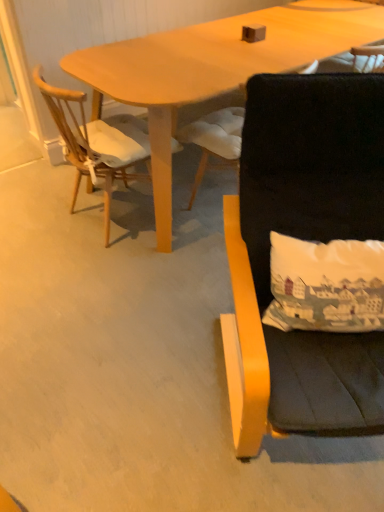
Question: From the image's perspective, would you say black fabric chair at right, which ranks as the first chair in right-to-left order, is positioned over black fabric chair at center, which is the second chair in right-to-left order?

Choices:
 (A) no
 (B) yes

Answer: (A)

Question: From the image's perspective, is black fabric chair at right, which ranks as the 3th chair in left-to-right order, under black fabric chair at center, which ranks as the 2th chair in left-to-right order?

Choices:
 (A) no
 (B) yes

Answer: (B)

Question: Does black fabric chair at right, which ranks as the 3th chair in left-to-right order, have a smaller size compared to black fabric chair at center, which ranks as the 2th chair in left-to-right order?

Choices:
 (A) no
 (B) yes

Answer: (A)

Question: From a real-world perspective, is black fabric chair at right, which ranks as the first chair in right-to-left order, over black fabric chair at center, which is the second chair in right-to-left order?

Choices:
 (A) no
 (B) yes

Answer: (B)

Question: Is black fabric chair at right, which ranks as the 3th chair in left-to-right order, facing towards black fabric chair at center, which ranks as the 2th chair in left-to-right order?

Choices:
 (A) yes
 (B) no

Answer: (B)

Question: Is there a large distance between black fabric chair at right, which ranks as the first chair in right-to-left order, and black fabric chair at center, which ranks as the 2th chair in left-to-right order?

Choices:
 (A) no
 (B) yes

Answer: (A)

Question: Considering the relative sizes of wooden chair at left, marked as the 1th chair in a left-to-right arrangement, and black fabric chair at right, which ranks as the 3th chair in left-to-right order, in the image provided, is wooden chair at left, marked as the 1th chair in a left-to-right arrangement, thinner than black fabric chair at right, which ranks as the 3th chair in left-to-right order,?

Choices:
 (A) yes
 (B) no

Answer: (A)

Question: Is wooden chair at left, which is counted as the third chair, starting from the right, positioned behind black fabric chair at right, which ranks as the 3th chair in left-to-right order?

Choices:
 (A) no
 (B) yes

Answer: (B)

Question: Is wooden chair at left, marked as the 1th chair in a left-to-right arrangement, positioned beyond the bounds of black fabric chair at right, which ranks as the 3th chair in left-to-right order?

Choices:
 (A) yes
 (B) no

Answer: (A)

Question: Would you say black fabric chair at right, which ranks as the 3th chair in left-to-right order, is part of wooden chair at left, marked as the 1th chair in a left-to-right arrangement,'s contents?

Choices:
 (A) no
 (B) yes

Answer: (A)

Question: Would you say wooden chair at left, marked as the 1th chair in a left-to-right arrangement, is a long distance from black fabric chair at right, which ranks as the 3th chair in left-to-right order?

Choices:
 (A) yes
 (B) no

Answer: (A)

Question: Is wooden chair at left, which is counted as the third chair, starting from the right, wider than black fabric chair at right, which ranks as the first chair in right-to-left order?

Choices:
 (A) yes
 (B) no

Answer: (B)

Question: Is wooden chair at left, which is counted as the third chair, starting from the right, further to camera compared to black fabric chair at center, which ranks as the 2th chair in left-to-right order?

Choices:
 (A) yes
 (B) no

Answer: (B)